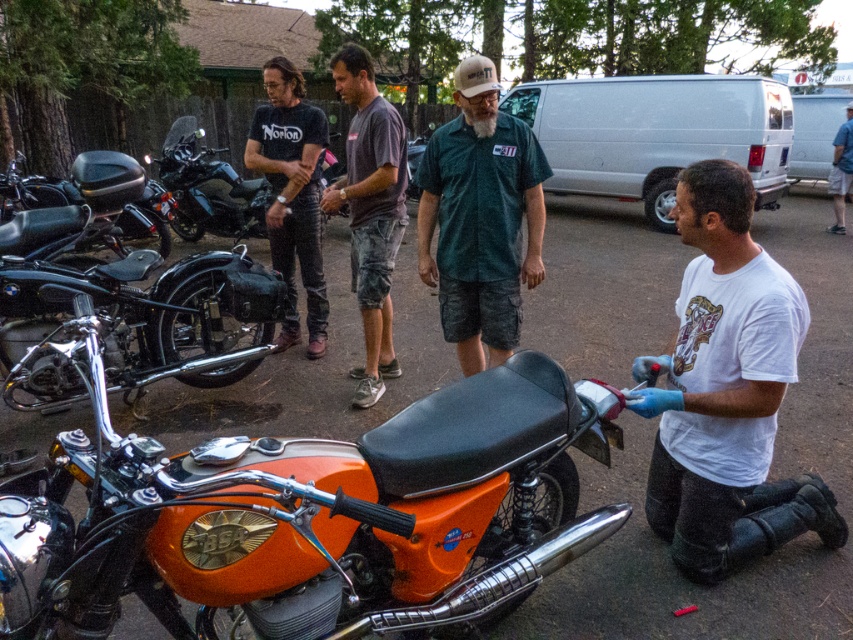
Does point (724, 570) lie behind point (3, 179)?

No, (724, 570) is in front of (3, 179).

Who is shorter, white matte shirt at lower right or matte black motorcycle at left?

matte black motorcycle at left

Where is `white matte shirt at lower right`? The width and height of the screenshot is (853, 640). white matte shirt at lower right is located at coordinates (726, 392).

Is green camo shorts at center to the left of dark gray cotton t-shirt at center from the viewer's perspective?

No, green camo shorts at center is not to the left of dark gray cotton t-shirt at center.

Which is below, green camo shorts at center or dark gray cotton t-shirt at center?

green camo shorts at center

In order to click on green camo shorts at center in this screenshot , I will do `click(480, 218)`.

Can you confirm if white matte van at upper center is smaller than green camo shorts at center?

No.

Can you confirm if white matte van at upper center is thinner than green camo shorts at center?

No, white matte van at upper center is not thinner than green camo shorts at center.

Which is in front, point (569, 170) or point (492, 250)?

Point (492, 250)

In order to click on white matte van at upper center in this screenshot , I will do `click(654, 132)`.